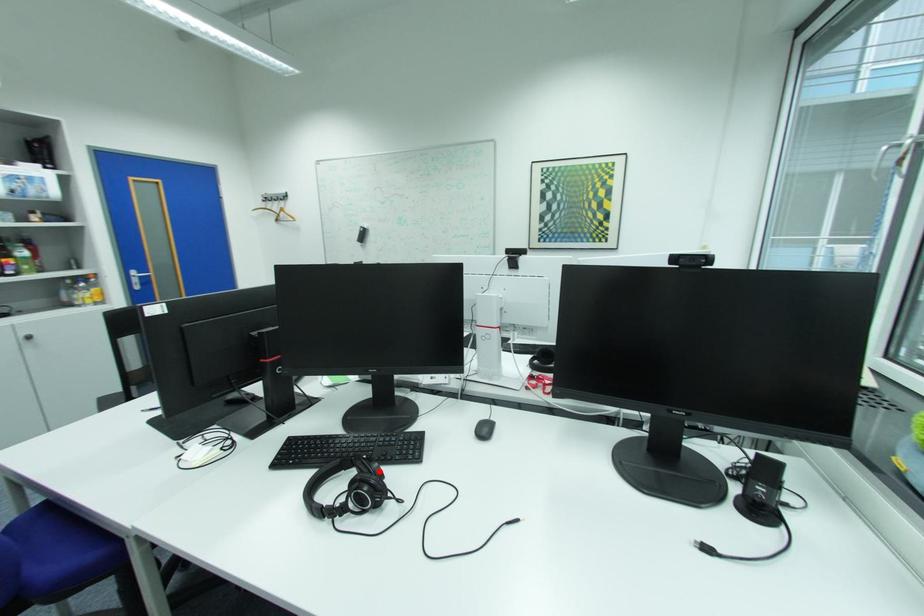
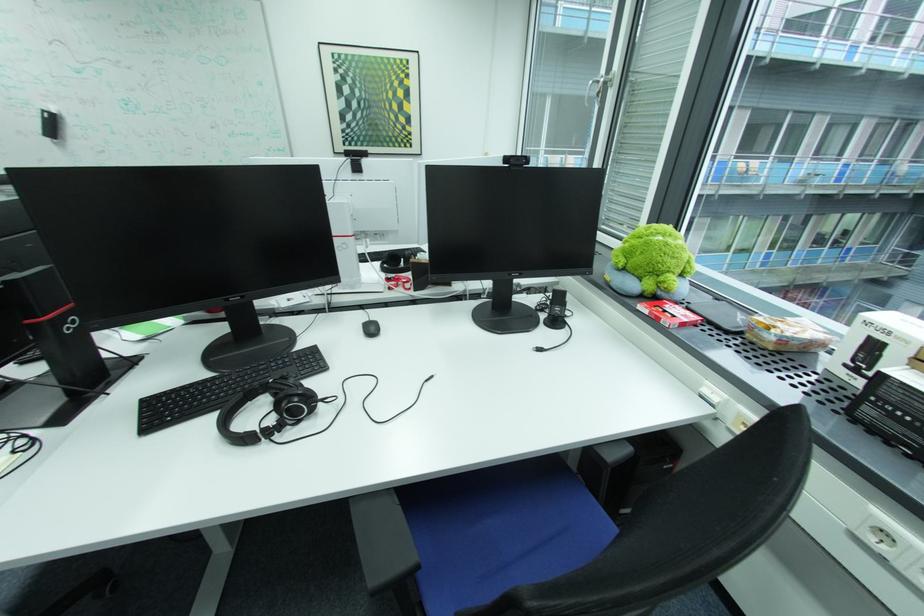
Locate, in the second image, the point that corresponds to the highlighted location in the first image.

(299, 387)